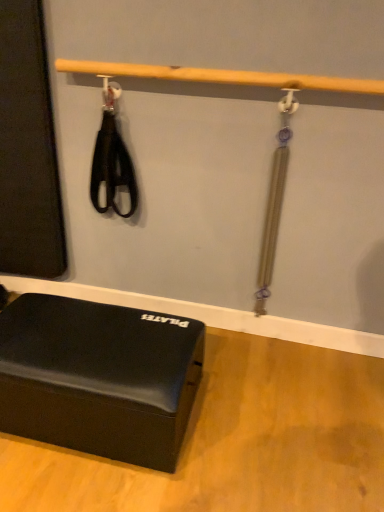
You are a GUI agent. You are given a task and a screenshot of the screen. Output one action in this format:
    pyautogui.click(x=<x>, y=<y>)
    Task: Click on the free location to the right of matte black foam block at lower left
    The height and width of the screenshot is (512, 384).
    Given the screenshot: What is the action you would take?
    272,414